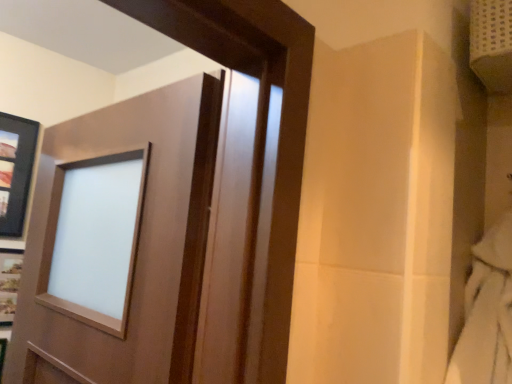
Question: From a real-world perspective, is satin wood door at center positioned above or below matte black picture frame at upper left?

Choices:
 (A) above
 (B) below

Answer: (B)

Question: From their relative heights in the image, would you say satin wood door at center is taller or shorter than matte black picture frame at upper left?

Choices:
 (A) short
 (B) tall

Answer: (B)

Question: Is satin wood door at center to the left or to the right of matte black picture frame at upper left in the image?

Choices:
 (A) left
 (B) right

Answer: (B)

Question: Is matte black picture frame at upper left in front of or behind satin wood door at center in the image?

Choices:
 (A) behind
 (B) front

Answer: (A)

Question: Does point (20, 130) appear closer or farther from the camera than point (292, 89)?

Choices:
 (A) closer
 (B) farther

Answer: (B)

Question: From a real-world perspective, is matte black picture frame at upper left above or below satin wood door at center?

Choices:
 (A) below
 (B) above

Answer: (B)

Question: From the image's perspective, is matte black picture frame at upper left located above or below satin wood door at center?

Choices:
 (A) below
 (B) above

Answer: (B)